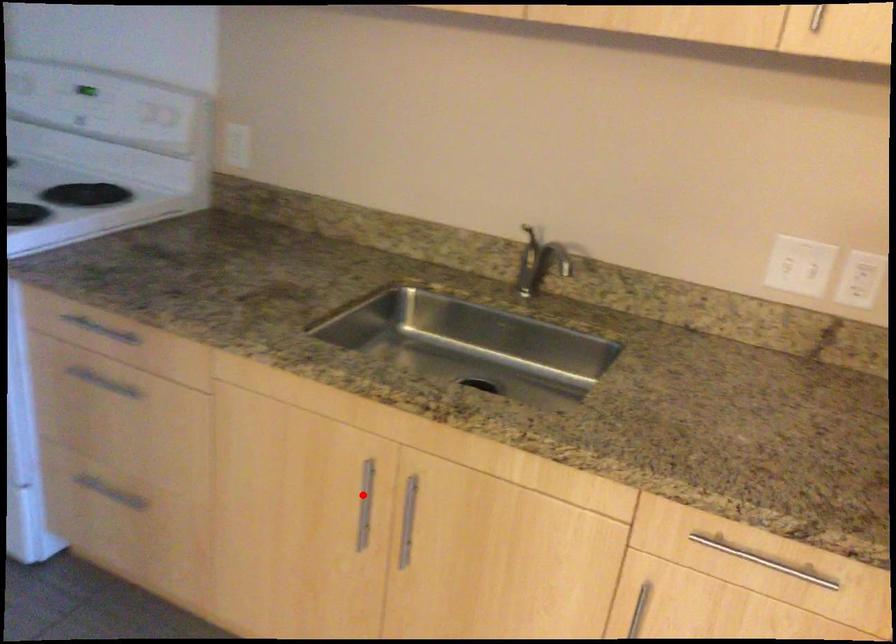
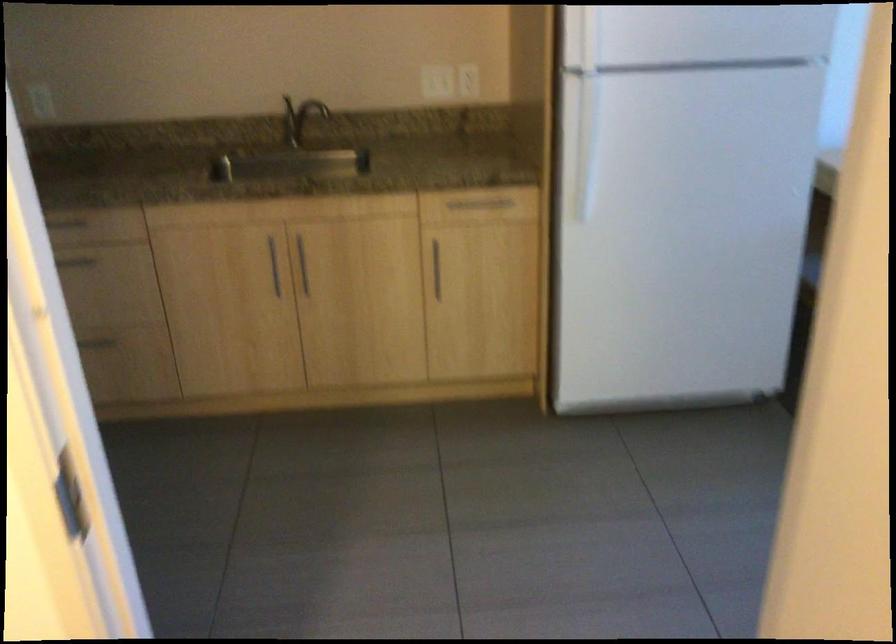
Question: I am providing you with two images of the same scene from different viewpoints. In image1, a red point is highlighted. Considering the same 3D point in image2, which of the following is correct?

Choices:
 (A) It is closer
 (B) It is farther

Answer: (B)